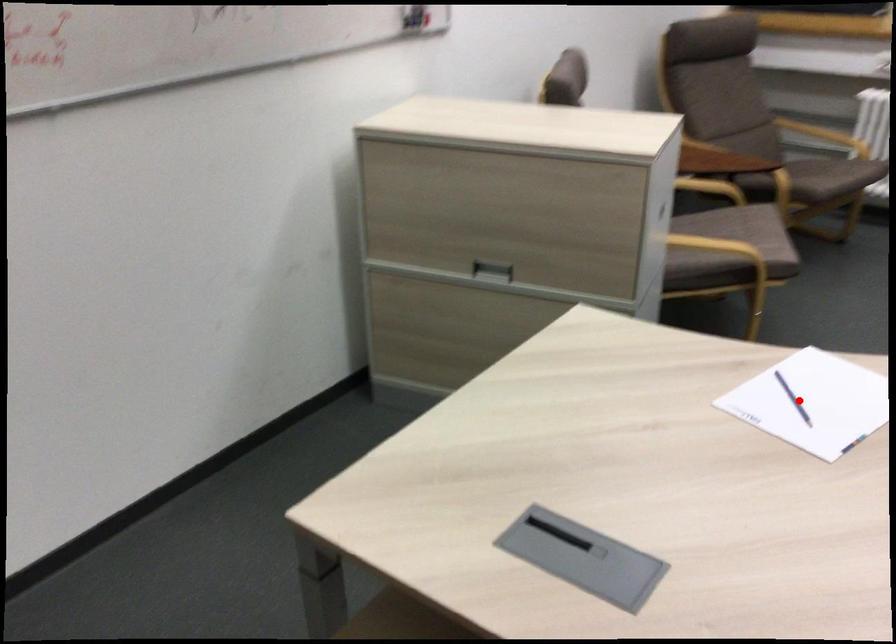
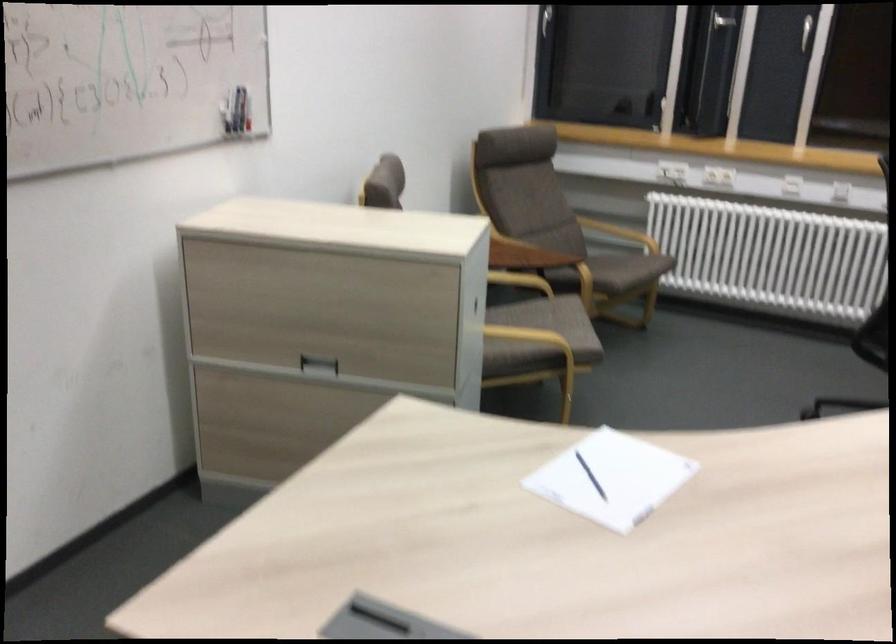
The point at the highlighted location is marked in the first image. Where is the corresponding point in the second image?

(590, 476)